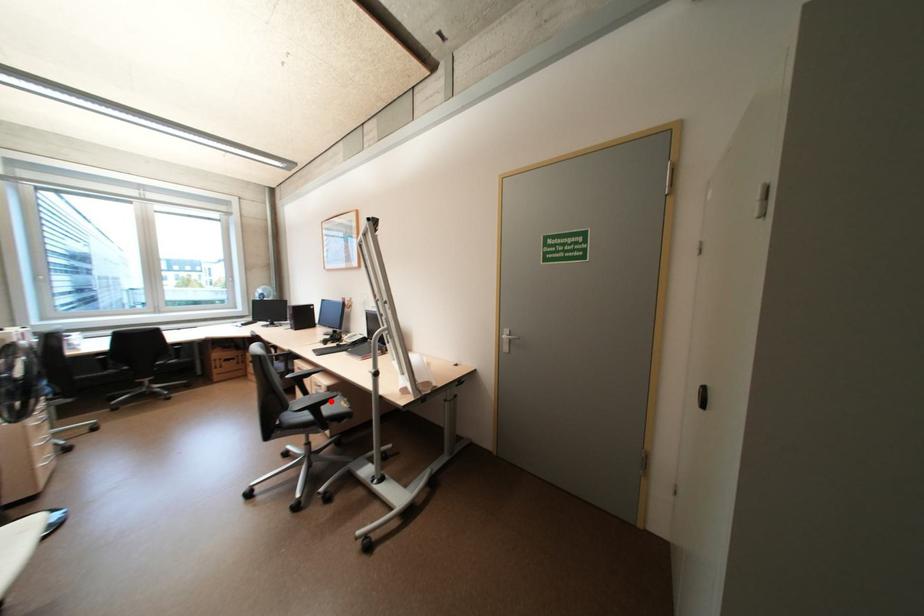
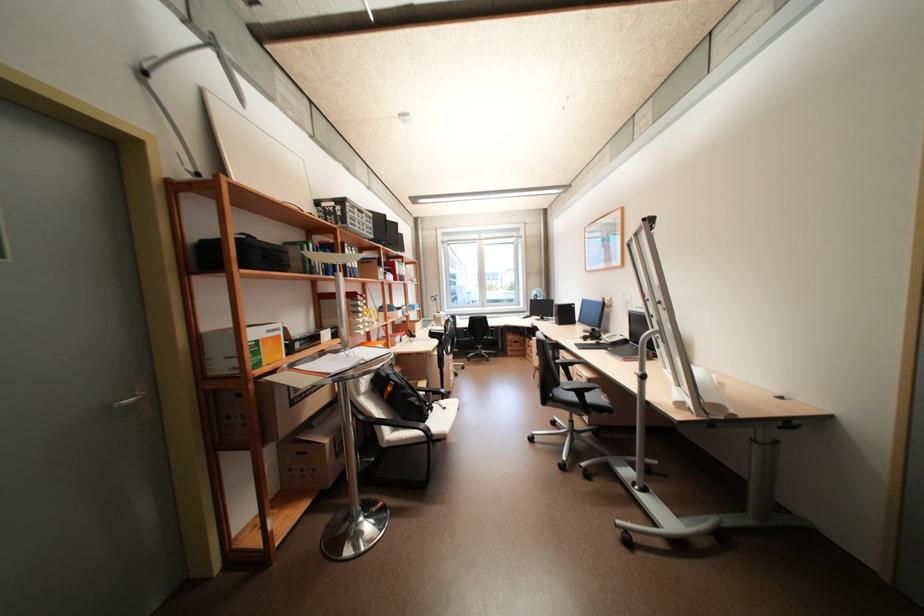
Question: I am providing you with two images of the same scene from different viewpoints. A red point is marked on the first image. At the location where the point appears in image 1, is it still visible in image 2?

Choices:
 (A) Yes
 (B) No

Answer: (A)